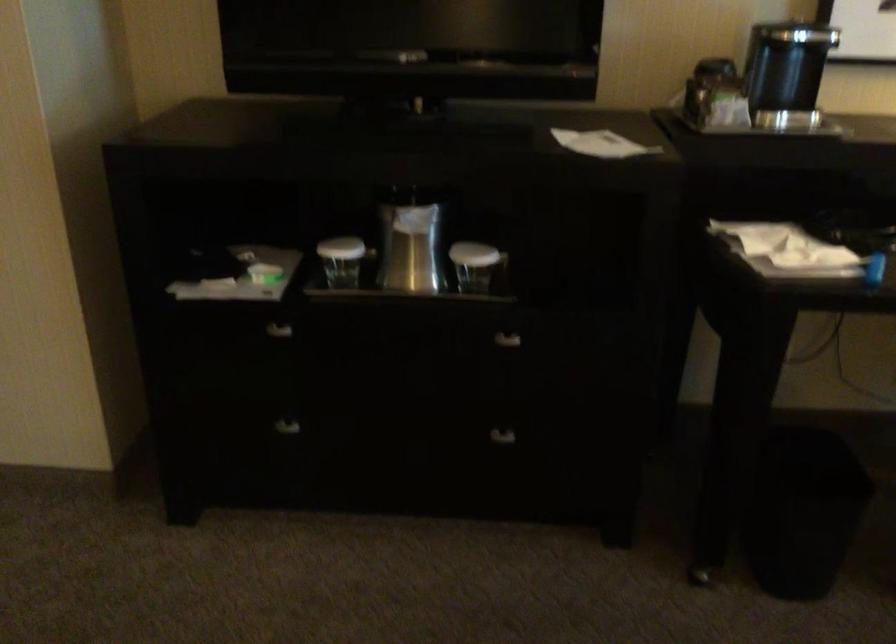
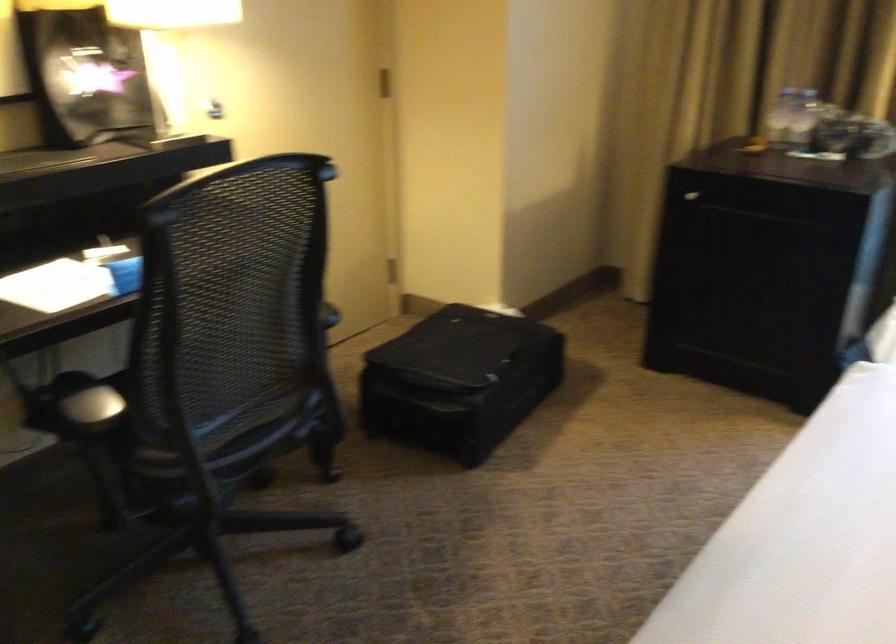
Question: The first image is from the beginning of the video and the second image is from the end. How did the camera likely rotate when shooting the video?

Choices:
 (A) Left
 (B) Right
 (C) Up
 (D) Down

Answer: (B)